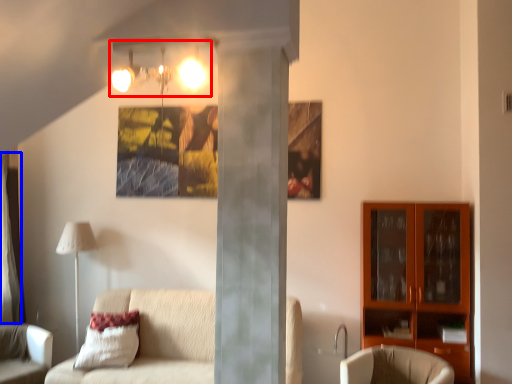
Question: Which object appears farthest to the camera in this image, light fixture (highlighted by a red box) or curtain (highlighted by a blue box)?

Choices:
 (A) light fixture
 (B) curtain

Answer: (B)